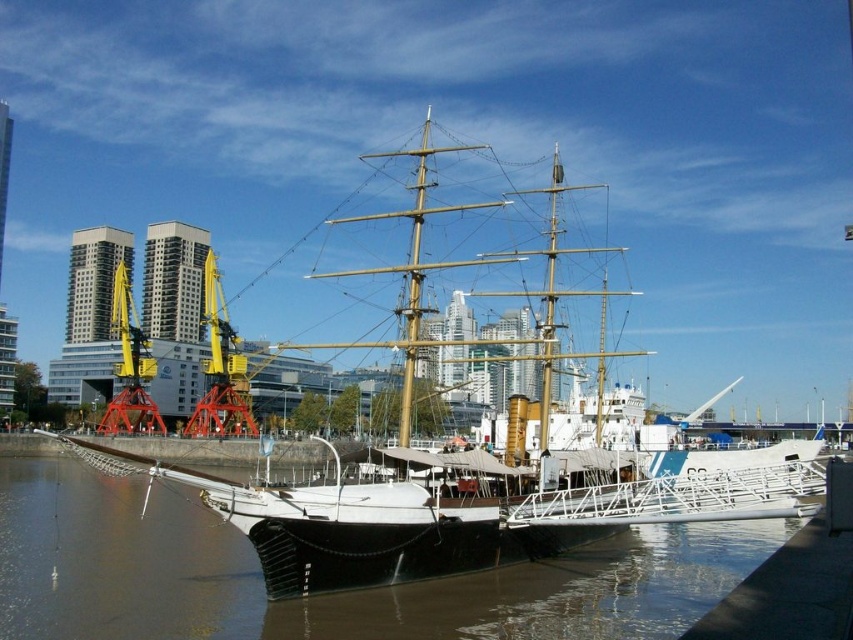
Between point (231, 637) and point (296, 554), which one is positioned behind?

Positioned behind is point (296, 554).

Can you confirm if smooth brown water at center is smaller than white wooden ship at center?

Indeed, smooth brown water at center has a smaller size compared to white wooden ship at center.

Between point (231, 593) and point (634, 488), which one is positioned in front?

Positioned in front is point (231, 593).

The height and width of the screenshot is (640, 853). I want to click on smooth brown water at center, so click(323, 595).